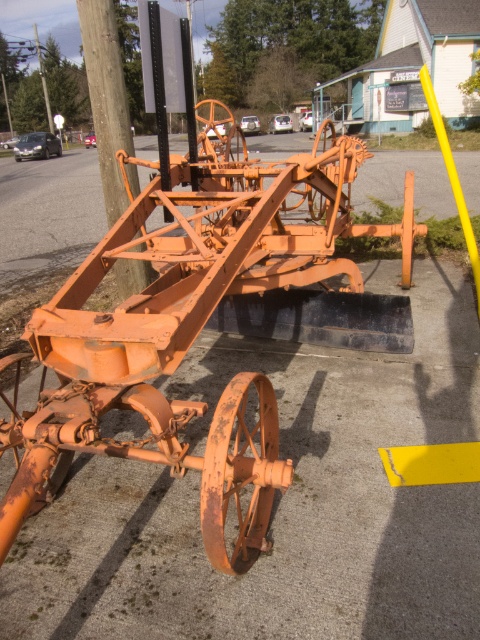
Is rusty orange tractor at center positioned before brushed metal telegraph pole at upper left?

That is True.

Does point (170, 428) lie in front of point (43, 72)?

That is True.

Is point (178, 465) in front of point (44, 83)?

Yes, it is.

This screenshot has height=640, width=480. Identify the location of rusty orange tractor at center. (202, 326).